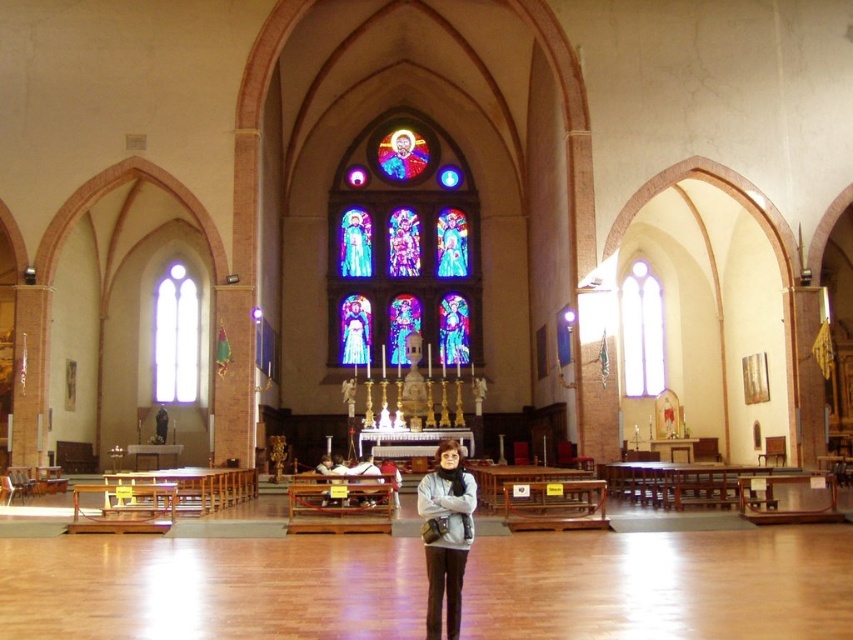
Can you confirm if gray matte sweater at center is taller than clear glass window at right?

No, gray matte sweater at center is not taller than clear glass window at right.

Between gray matte sweater at center and clear glass window at right, which one is positioned higher?

Positioned higher is clear glass window at right.

Which is behind, point (465, 513) or point (648, 314)?

Positioned behind is point (648, 314).

Identify the location of gray matte sweater at center. Image resolution: width=853 pixels, height=640 pixels. (445, 536).

How distant is clear glass window at left from clear glass window at right?

The distance of clear glass window at left from clear glass window at right is 48.79 meters.

In the scene shown: Can you confirm if clear glass window at left is taller than clear glass window at right?

No.

Which is in front, point (198, 333) or point (627, 332)?

Positioned in front is point (198, 333).

Identify the location of clear glass window at left. (177, 337).

You are a GUI agent. You are given a task and a screenshot of the screen. Output one action in this format:
    pyautogui.click(x=<x>, y=<y>)
    Task: Click on the stained glass window at center
    
    Given the screenshot: What is the action you would take?
    pyautogui.click(x=403, y=244)

Is stained glass window at center taller than clear glass window at left?

Correct, stained glass window at center is much taller as clear glass window at left.

Where is `stained glass window at center`? stained glass window at center is located at coordinates (403, 244).

Locate an element on the screen. stained glass window at center is located at coordinates (403, 244).